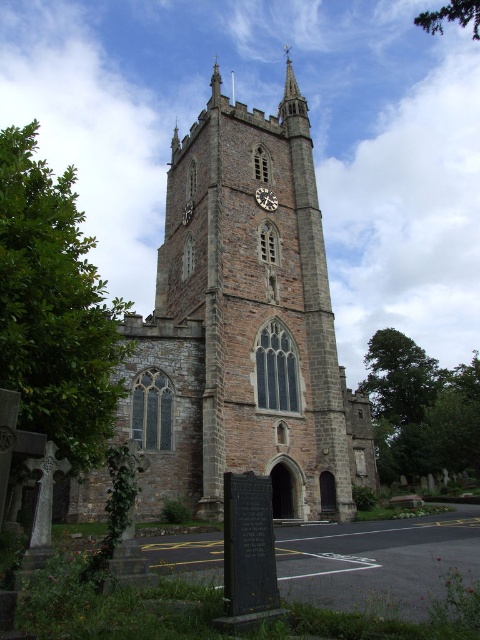
Question: Is stone church at center closer to the viewer compared to dark gray stone clock at center?

Choices:
 (A) no
 (B) yes

Answer: (B)

Question: Does stone church at center have a greater width compared to dark gray stone clock at center?

Choices:
 (A) yes
 (B) no

Answer: (A)

Question: Does stone church at center have a smaller size compared to dark gray stone clock at center?

Choices:
 (A) no
 (B) yes

Answer: (A)

Question: Which point is closer to the camera?

Choices:
 (A) dark gray stone clock at center
 (B) stone church at center

Answer: (B)